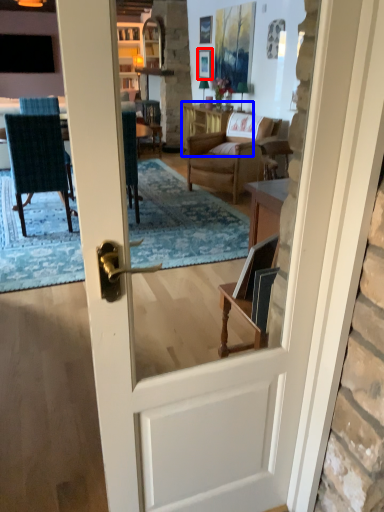
Question: Which object appears farthest to the camera in this image, picture frame (highlighted by a red box) or table (highlighted by a blue box)?

Choices:
 (A) picture frame
 (B) table

Answer: (A)